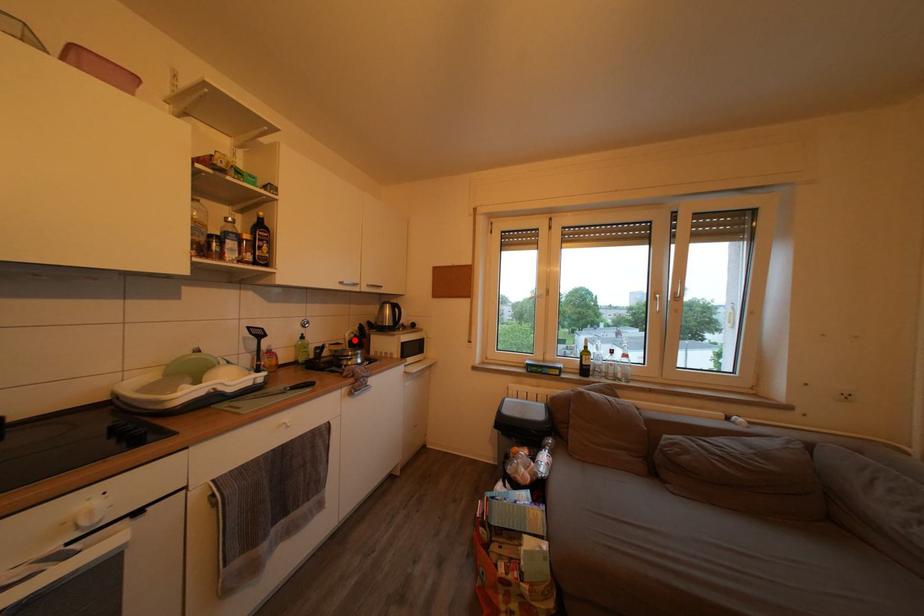
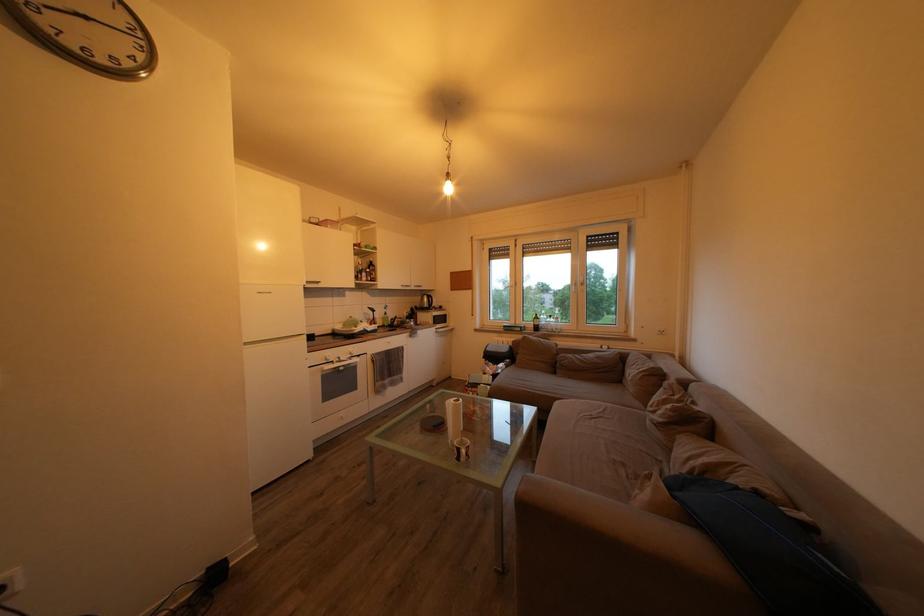
The point at the highlighted location is marked in the first image. Where is the corresponding point in the second image?

(412, 318)